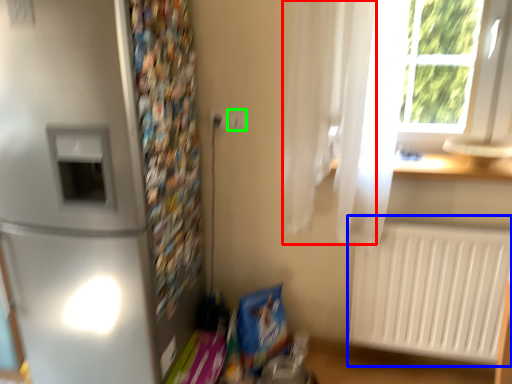
Question: Considering the real-world distances, which object is farthest from curtain (highlighted by a red box)? radiator (highlighted by a blue box) or electric outlet (highlighted by a green box)?

Choices:
 (A) radiator
 (B) electric outlet

Answer: (A)